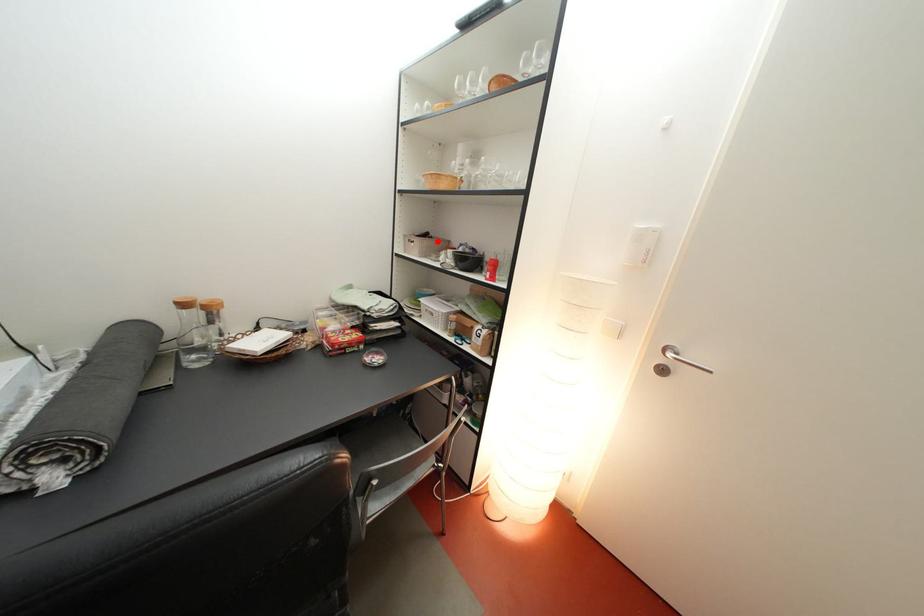
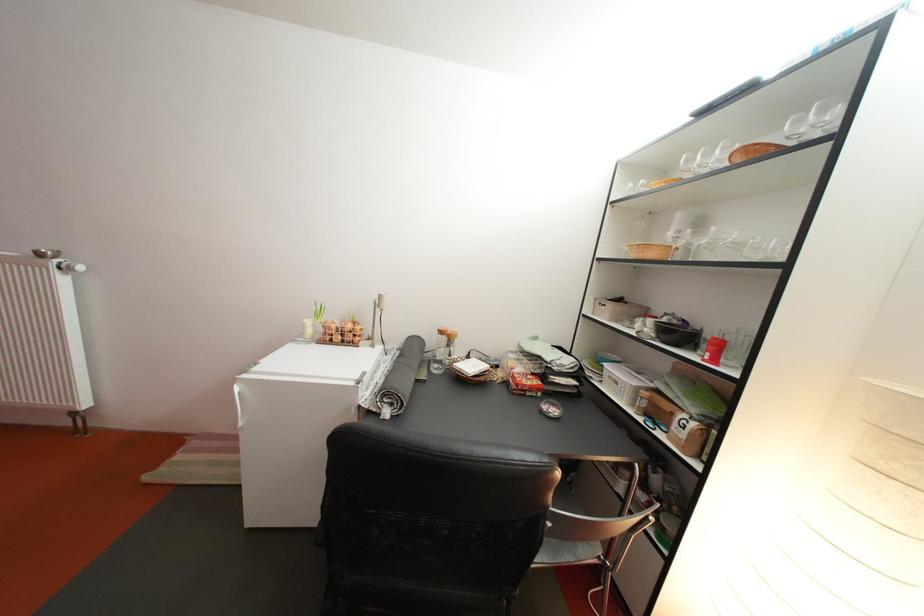
Find the pixel in the second image that matches the highlighted location in the first image.

(630, 306)